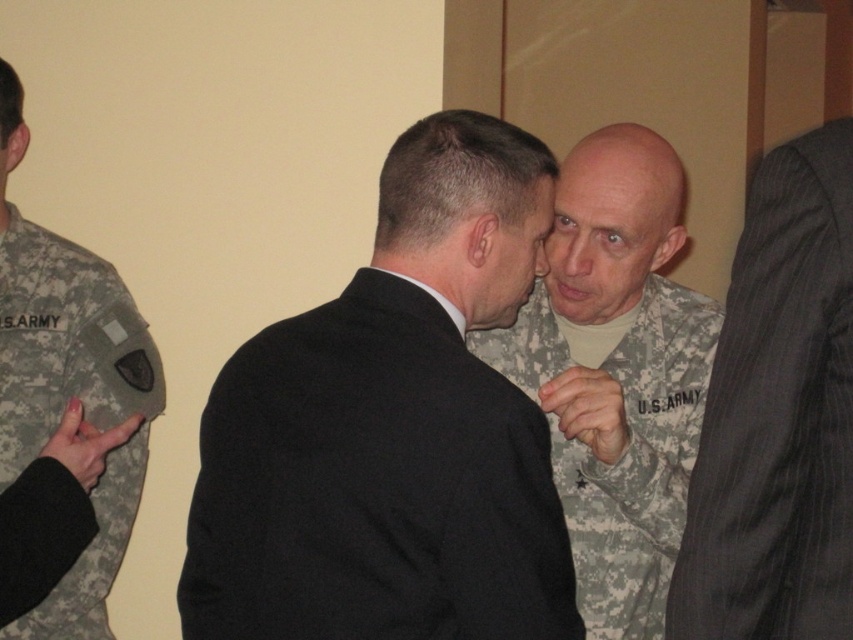
Question: Does black pinstripe suit at right have a greater width compared to camouflage fabric us army uniform at left?

Choices:
 (A) yes
 (B) no

Answer: (B)

Question: Can you confirm if black wool suit at center is bigger than camouflage fabric us army uniform at center?

Choices:
 (A) yes
 (B) no

Answer: (A)

Question: Which point is farther from the camera taking this photo?

Choices:
 (A) (409, 161)
 (B) (637, 365)
 (C) (786, 547)

Answer: (B)

Question: Does black wool suit at center come behind black pinstripe suit at right?

Choices:
 (A) yes
 (B) no

Answer: (A)

Question: Which object is the closest to the black wool suit at center?

Choices:
 (A) black pinstripe suit at right
 (B) camouflage fabric us army uniform at center

Answer: (A)

Question: Which of the following is the closest to the observer?

Choices:
 (A) (146, 342)
 (B) (849, 557)

Answer: (B)